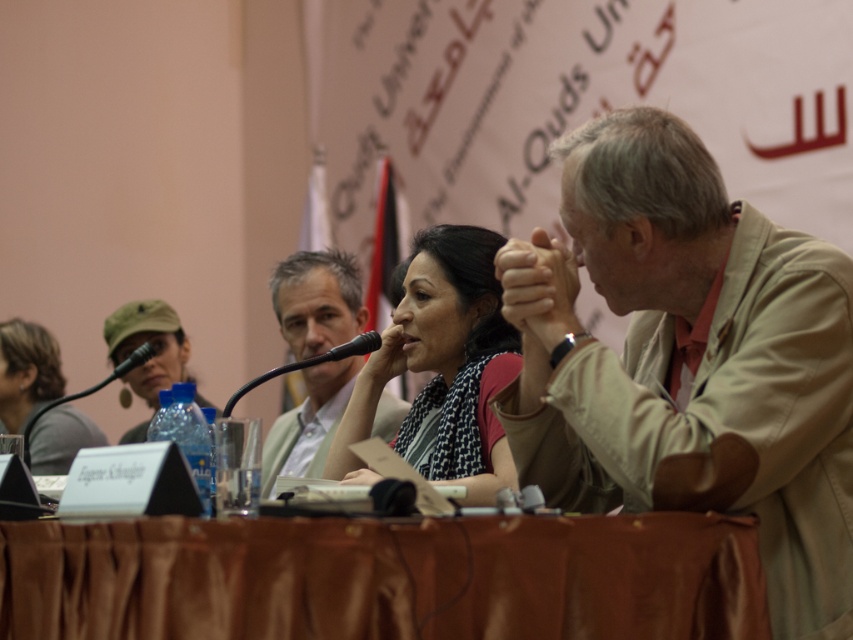
You are attending a conference and need to identify the speaker who is wearing the shorter accessory. The speaker has a matte black scarf at center and a matte green shirt at center. Which accessory is shorter?

The matte black scarf at center is shorter than the matte green shirt at center.